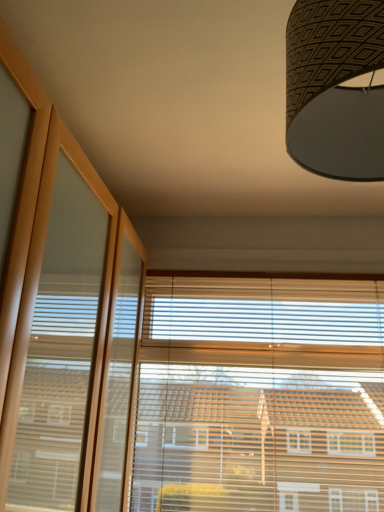
Question: Is textured brown lampshade at upper right directly adjacent to wooden blinds at center?

Choices:
 (A) no
 (B) yes

Answer: (A)

Question: Is textured brown lampshade at upper right far from wooden blinds at center?

Choices:
 (A) no
 (B) yes

Answer: (B)

Question: From a real-world perspective, is textured brown lampshade at upper right on top of wooden blinds at center?

Choices:
 (A) yes
 (B) no

Answer: (A)

Question: Is textured brown lampshade at upper right shorter than wooden blinds at center?

Choices:
 (A) yes
 (B) no

Answer: (A)

Question: Does textured brown lampshade at upper right turn towards wooden blinds at center?

Choices:
 (A) no
 (B) yes

Answer: (A)

Question: Does textured brown lampshade at upper right lie in front of wooden blinds at center?

Choices:
 (A) yes
 (B) no

Answer: (A)

Question: Does wooden blinds at center have a smaller size compared to textured brown lampshade at upper right?

Choices:
 (A) yes
 (B) no

Answer: (B)

Question: Is wooden blinds at center outside of textured brown lampshade at upper right?

Choices:
 (A) yes
 (B) no

Answer: (A)

Question: Considering the relative sizes of wooden blinds at center and textured brown lampshade at upper right in the image provided, is wooden blinds at center thinner than textured brown lampshade at upper right?

Choices:
 (A) no
 (B) yes

Answer: (B)

Question: From the image's perspective, is wooden blinds at center located above textured brown lampshade at upper right?

Choices:
 (A) no
 (B) yes

Answer: (A)

Question: From the image's perspective, would you say wooden blinds at center is shown under textured brown lampshade at upper right?

Choices:
 (A) no
 (B) yes

Answer: (B)

Question: From a real-world perspective, is wooden blinds at center beneath textured brown lampshade at upper right?

Choices:
 (A) no
 (B) yes

Answer: (B)

Question: Considering the relative positions of wooden blinds at center and textured brown lampshade at upper right in the image provided, is wooden blinds at center to the left or to the right of textured brown lampshade at upper right?

Choices:
 (A) left
 (B) right

Answer: (B)